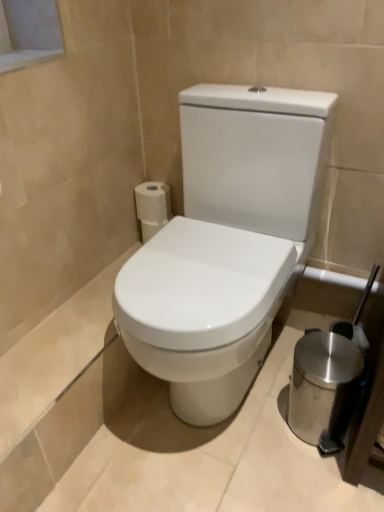
Question: Is white matte toilet paper at upper left taller than polished stainless steel trash can at lower right?

Choices:
 (A) no
 (B) yes

Answer: (A)

Question: From a real-world perspective, is white matte toilet paper at upper left located higher than polished stainless steel trash can at lower right?

Choices:
 (A) yes
 (B) no

Answer: (A)

Question: Does white matte toilet paper at upper left have a lesser height compared to polished stainless steel trash can at lower right?

Choices:
 (A) no
 (B) yes

Answer: (B)

Question: Is white matte toilet paper at upper left outside polished stainless steel trash can at lower right?

Choices:
 (A) yes
 (B) no

Answer: (A)

Question: Is white matte toilet paper at upper left far from polished stainless steel trash can at lower right?

Choices:
 (A) yes
 (B) no

Answer: (B)

Question: Considering the relative positions of white matte toilet paper at upper left and polished stainless steel trash can at lower right in the image provided, is white matte toilet paper at upper left to the left of polished stainless steel trash can at lower right from the viewer's perspective?

Choices:
 (A) yes
 (B) no

Answer: (A)

Question: Is white matte toilet paper at upper left far from white glossy toilet at center?

Choices:
 (A) yes
 (B) no

Answer: (B)

Question: Is white matte toilet paper at upper left located outside white glossy toilet at center?

Choices:
 (A) yes
 (B) no

Answer: (A)

Question: Would you say white matte toilet paper at upper left contains white glossy toilet at center?

Choices:
 (A) yes
 (B) no

Answer: (B)

Question: From the image's perspective, would you say white matte toilet paper at upper left is positioned over white glossy toilet at center?

Choices:
 (A) no
 (B) yes

Answer: (B)

Question: Considering the relative sizes of white matte toilet paper at upper left and white glossy toilet at center in the image provided, is white matte toilet paper at upper left shorter than white glossy toilet at center?

Choices:
 (A) yes
 (B) no

Answer: (A)

Question: Is white matte toilet paper at upper left next to white glossy toilet at center?

Choices:
 (A) no
 (B) yes

Answer: (A)

Question: Does polished stainless steel trash can at lower right have a greater width compared to white matte toilet paper at upper left?

Choices:
 (A) yes
 (B) no

Answer: (A)